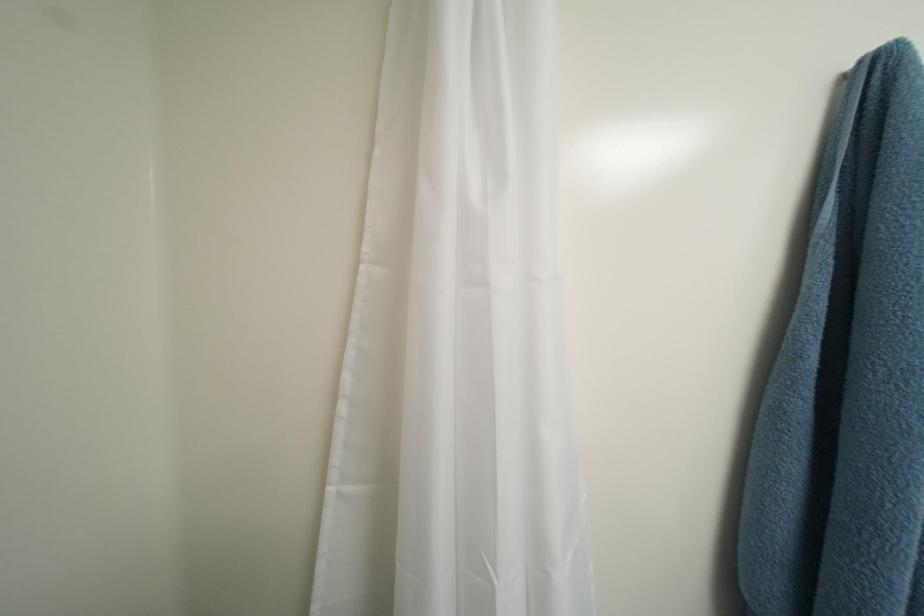
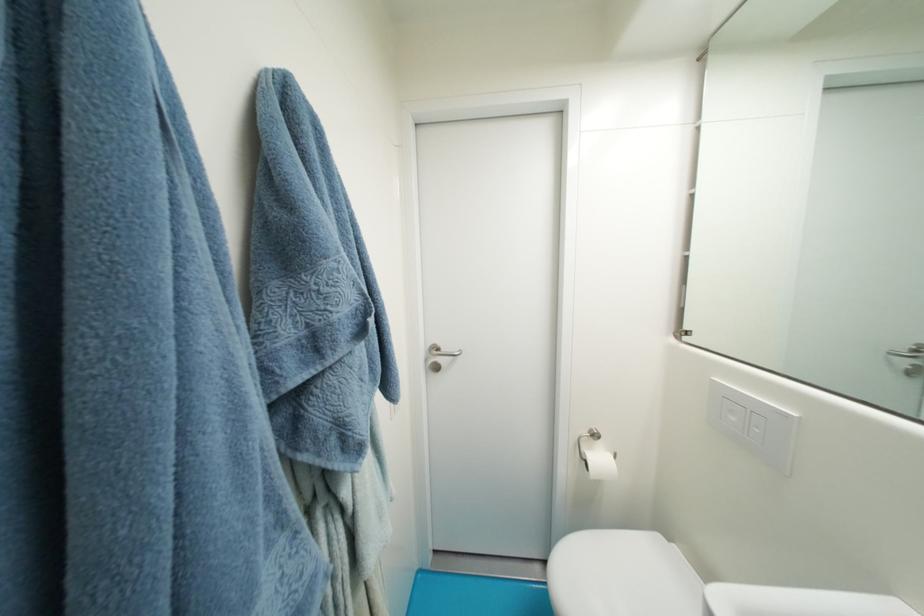
Question: The images are taken continuously from a first-person perspective. In which direction is your viewpoint rotating?

Choices:
 (A) Left
 (B) Right
 (C) Up
 (D) Down

Answer: (B)